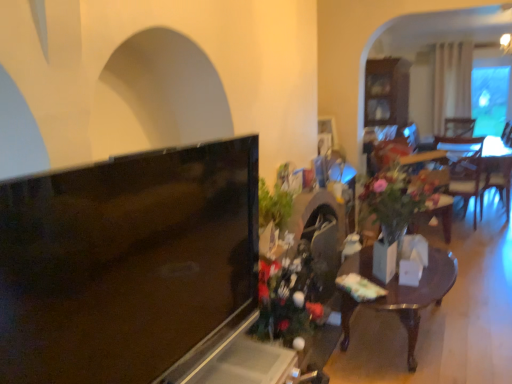
Where is `free region under wooden table at center (from a real-world perspective)`? free region under wooden table at center (from a real-world perspective) is located at coordinates (387, 332).